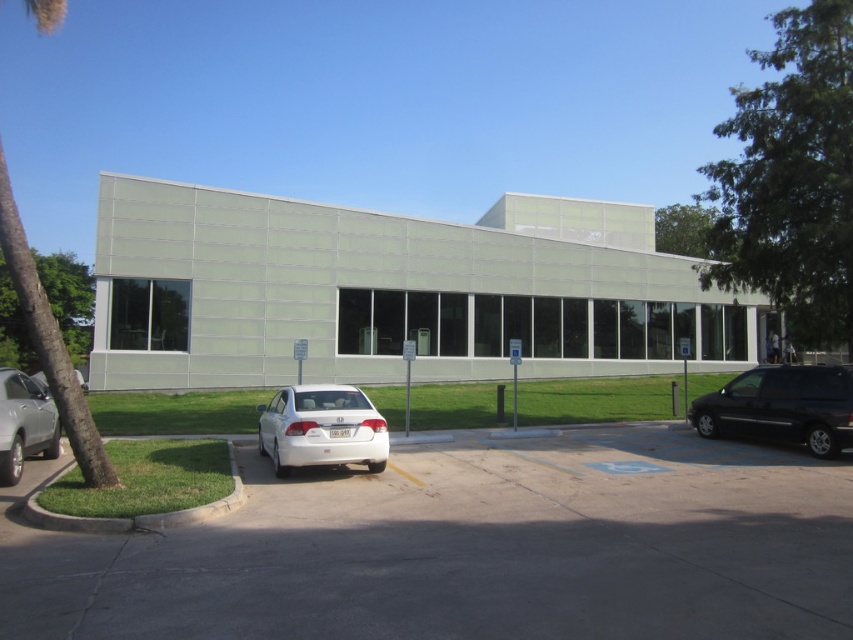
You are a delivery driver arriving at the modern building. You need to park your truck, which is 2 meters wide, in the gray asphalt parking lot at center. Can your truck fit in the parking space next to the black matte van at right?

The gray asphalt parking lot at center is wider than the black matte van at right, so the truck which is 2 meters wide can fit in the parking space next to the black matte van at right as long as the total width of both the parking lot and the van accommodates it.

You are a delivery person arriving at the building. You need to park your vehicle between the black matte van at right and the green textured palm tree at left. Is there enough space between them for your van?

The black matte van at right is located below green textured palm tree at left, so there is space between them for your van to park.